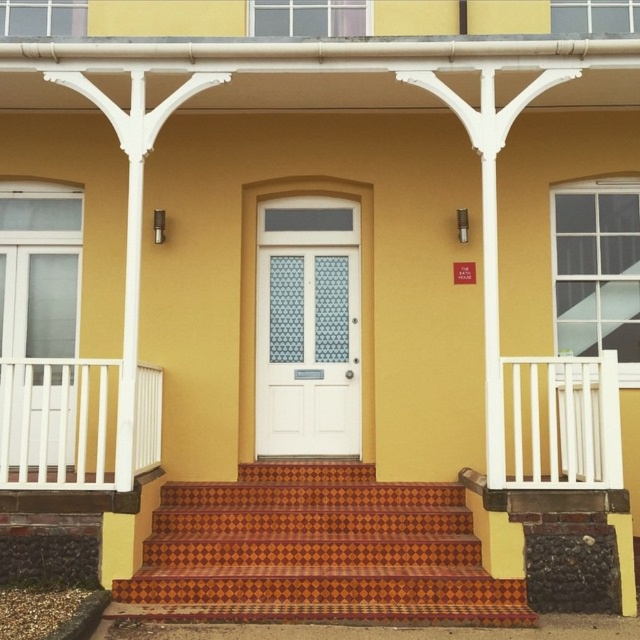
Who is positioned more to the right, terracotta checkered tile stairs at center or white wooden balustrade at left?

From the viewer's perspective, terracotta checkered tile stairs at center appears more on the right side.

Which is behind, point (180, 580) or point (156, 390)?

Positioned behind is point (156, 390).

Is point (205, 548) in front of point (44, 483)?

No.

Locate an element on the screen. This screenshot has height=640, width=640. terracotta checkered tile stairs at center is located at coordinates (316, 552).

Does terracotta checkered tile stairs at center have a smaller size compared to white wooden balustrade at right?

No.

Measure the distance between terracotta checkered tile stairs at center and white wooden balustrade at right.

They are 1.20 meters apart.

Between point (241, 525) and point (556, 472), which one is positioned behind?

The point (241, 525) is more distant.

You are a GUI agent. You are given a task and a screenshot of the screen. Output one action in this format:
    pyautogui.click(x=<x>, y=<y>)
    Task: Click on the terracotta checkered tile stairs at center
    The image size is (640, 640).
    Given the screenshot: What is the action you would take?
    pyautogui.click(x=316, y=552)

Is point (272, 317) positioned in front of point (161, 403)?

No.

Does white glossy door at center have a greater height compared to white wooden balustrade at left?

Yes.

Is point (340, 369) farther from camera compared to point (36, 394)?

Yes, point (340, 369) is behind point (36, 394).

Where is `white glossy door at center`? The width and height of the screenshot is (640, 640). white glossy door at center is located at coordinates (307, 353).